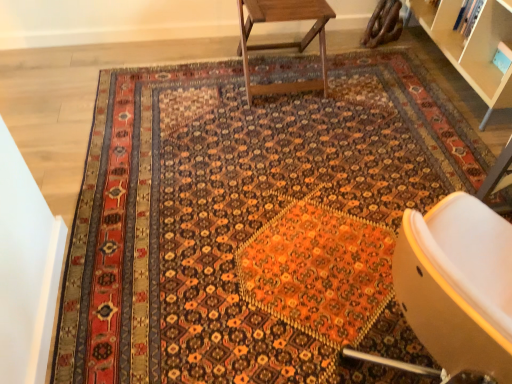
Question: Considering the relative positions of matte orange chair at lower right and wooden table at upper center in the image provided, is matte orange chair at lower right to the right of wooden table at upper center from the viewer's perspective?

Choices:
 (A) yes
 (B) no

Answer: (A)

Question: Is matte orange chair at lower right bigger than wooden table at upper center?

Choices:
 (A) yes
 (B) no

Answer: (A)

Question: Could you tell me if matte orange chair at lower right is facing wooden table at upper center?

Choices:
 (A) no
 (B) yes

Answer: (A)

Question: Is matte orange chair at lower right positioned beyond the bounds of wooden table at upper center?

Choices:
 (A) no
 (B) yes

Answer: (B)

Question: Does matte orange chair at lower right lie in front of wooden table at upper center?

Choices:
 (A) yes
 (B) no

Answer: (A)

Question: From the image's perspective, is matte orange chair at lower right located above wooden table at upper center?

Choices:
 (A) yes
 (B) no

Answer: (B)

Question: Can you confirm if wooden table at upper center is bigger than matte orange chair at lower right?

Choices:
 (A) yes
 (B) no

Answer: (B)

Question: Is wooden table at upper center positioned with its back to matte orange chair at lower right?

Choices:
 (A) no
 (B) yes

Answer: (A)

Question: Considering the relative sizes of wooden table at upper center and matte orange chair at lower right in the image provided, is wooden table at upper center shorter than matte orange chair at lower right?

Choices:
 (A) no
 (B) yes

Answer: (B)

Question: Is wooden table at upper center thinner than matte orange chair at lower right?

Choices:
 (A) yes
 (B) no

Answer: (A)

Question: Is the position of wooden table at upper center more distant than that of matte orange chair at lower right?

Choices:
 (A) no
 (B) yes

Answer: (B)

Question: Is matte orange chair at lower right located within wooden table at upper center?

Choices:
 (A) no
 (B) yes

Answer: (A)

Question: Considering the positions of point (240, 14) and point (492, 332), is point (240, 14) closer or farther from the camera than point (492, 332)?

Choices:
 (A) closer
 (B) farther

Answer: (B)